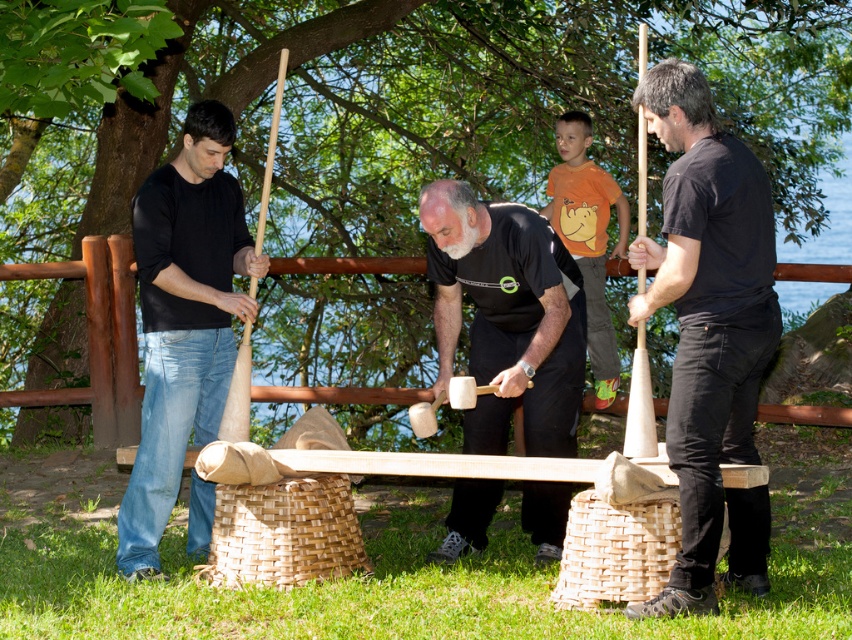
Question: Does black matte shirt at right have a lesser width compared to smooth wooden mallets at center?

Choices:
 (A) no
 (B) yes

Answer: (B)

Question: Can you confirm if black matte shirt at right is positioned below matte black shirt at left?

Choices:
 (A) yes
 (B) no

Answer: (B)

Question: Which of the following is the closest to the observer?

Choices:
 (A) (237, 243)
 (B) (714, 611)

Answer: (B)

Question: Is black matte shirt at right closer to the viewer compared to matte black shirt at left?

Choices:
 (A) yes
 (B) no

Answer: (A)

Question: Which object is the closest to the smooth wooden mallets at center?

Choices:
 (A) black matte shirt at right
 (B) matte black shirt at left

Answer: (A)

Question: Among these points, which one is farthest from the camera?

Choices:
 (A) (204, 113)
 (B) (490, 253)

Answer: (A)